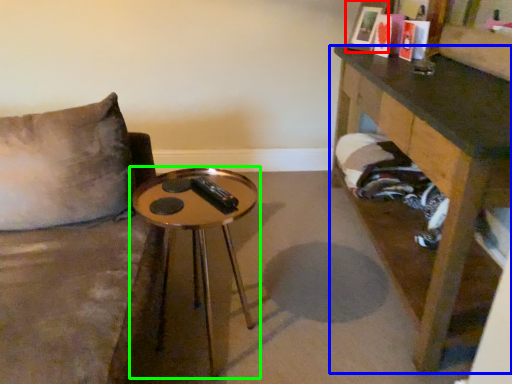
Question: Based on their relative distances, which object is farther from picture frame (highlighted by a red box)? Choose from table (highlighted by a blue box) and table (highlighted by a green box).

Choices:
 (A) table
 (B) table

Answer: (B)